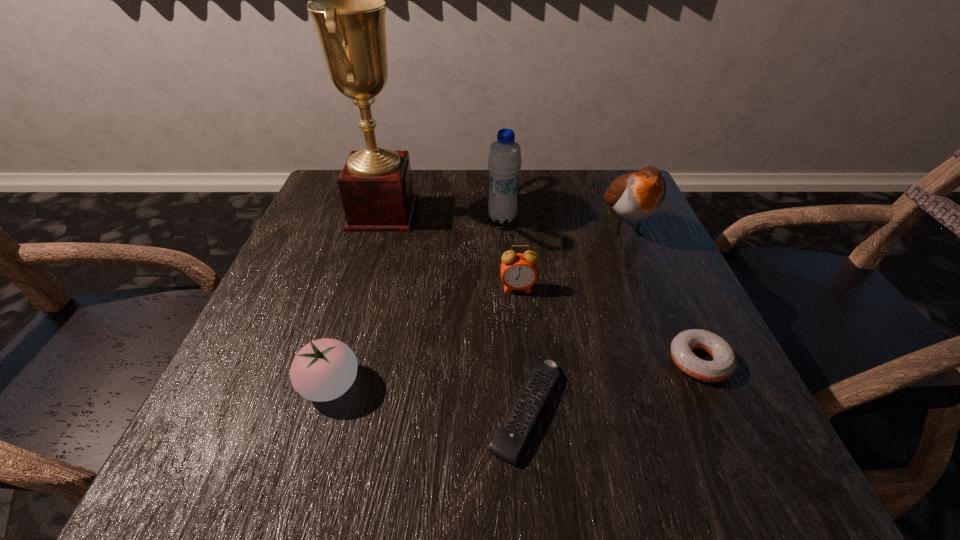
Where is `the sixth closest object to the tomato`? the sixth closest object to the tomato is located at coordinates point(636,196).

Find the location of `object identified as the second closest to the remote control`. object identified as the second closest to the remote control is located at coordinates (724, 362).

Where is `free space that satisfies the following two spatial constraints: 1. on the plaque of the tallest object; 2. on the left side of the sixth tallest object`? The width and height of the screenshot is (960, 540). free space that satisfies the following two spatial constraints: 1. on the plaque of the tallest object; 2. on the left side of the sixth tallest object is located at coordinates (340, 361).

Where is `vacant region that satisfies the following two spatial constraints: 1. on the plaque of the trophy cup; 2. on the back side of the second shortest object`? vacant region that satisfies the following two spatial constraints: 1. on the plaque of the trophy cup; 2. on the back side of the second shortest object is located at coordinates (340, 361).

The width and height of the screenshot is (960, 540). Find the location of `vacant space that satisfies the following two spatial constraints: 1. on the plaque of the tallest object; 2. on the right side of the shortest object`. vacant space that satisfies the following two spatial constraints: 1. on the plaque of the tallest object; 2. on the right side of the shortest object is located at coordinates (325, 411).